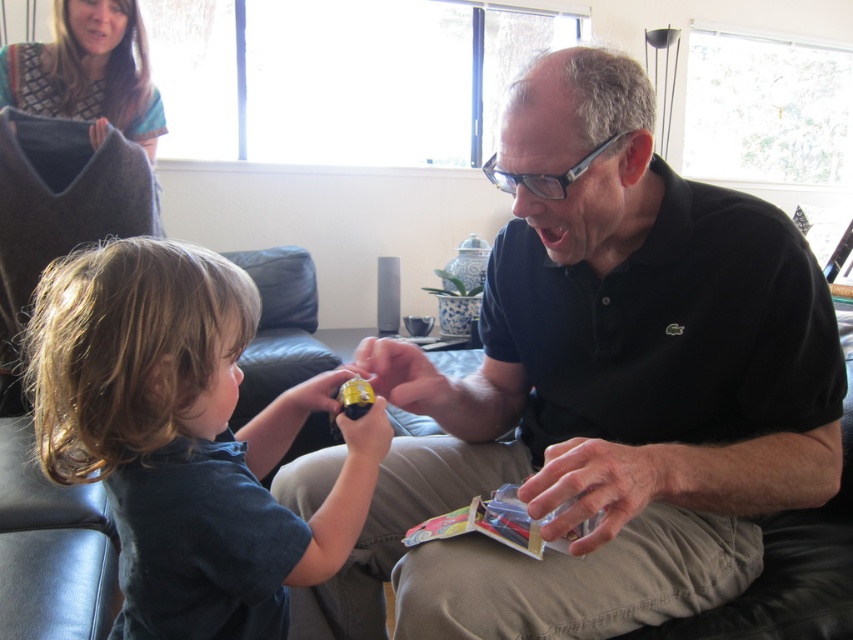
Is black matte shirt at center behind translucent plastic cards at center?

No, black matte shirt at center is closer to the viewer.

Who is positioned more to the left, black matte shirt at center or translucent plastic cards at center?

translucent plastic cards at center is more to the left.

You are a GUI agent. You are given a task and a screenshot of the screen. Output one action in this format:
    pyautogui.click(x=<x>, y=<y>)
    Task: Click on the black matte shirt at center
    The height and width of the screenshot is (640, 853).
    Given the screenshot: What is the action you would take?
    pyautogui.click(x=602, y=388)

Locate an element on the screen. This screenshot has width=853, height=640. black matte shirt at center is located at coordinates (602, 388).

Based on the photo, can you confirm if smooth dark blue shirt at lower left is wider than translucent plastic cards at center?

Yes.

Is point (234, 618) more distant than point (404, 538)?

No.

Which is behind, point (55, 353) or point (451, 536)?

Point (451, 536)

Where is `smooth dark blue shirt at lower left`? The width and height of the screenshot is (853, 640). smooth dark blue shirt at lower left is located at coordinates (184, 438).

Is point (746, 248) farther from camera compared to point (180, 540)?

Yes, it is.

What do you see at coordinates (602, 388) in the screenshot? Image resolution: width=853 pixels, height=640 pixels. I see `black matte shirt at center` at bounding box center [602, 388].

You are a GUI agent. You are given a task and a screenshot of the screen. Output one action in this format:
    pyautogui.click(x=<x>, y=<y>)
    Task: Click on the black matte shirt at center
    The height and width of the screenshot is (640, 853).
    Given the screenshot: What is the action you would take?
    pyautogui.click(x=602, y=388)